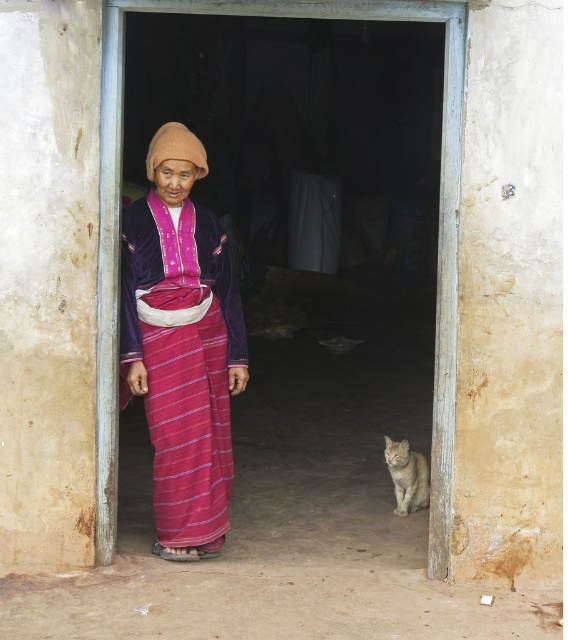
Question: Which object is closer to the camera taking this photo?

Choices:
 (A) golden fur cat at lower right
 (B) wooden door at center
 (C) velvet purple blouse at center

Answer: (B)

Question: Can you confirm if velvet purple blouse at center is smaller than golden fur cat at lower right?

Choices:
 (A) yes
 (B) no

Answer: (B)

Question: Which of the following is the farthest from the observer?

Choices:
 (A) wooden door at center
 (B) golden fur cat at lower right
 (C) velvet purple blouse at center

Answer: (B)

Question: Is velvet purple blouse at center positioned before golden fur cat at lower right?

Choices:
 (A) no
 (B) yes

Answer: (B)

Question: Can you confirm if velvet purple blouse at center is smaller than golden fur cat at lower right?

Choices:
 (A) no
 (B) yes

Answer: (A)

Question: Estimate the real-world distances between objects in this image. Which object is closer to the velvet purple blouse at center?

Choices:
 (A) wooden door at center
 (B) golden fur cat at lower right

Answer: (A)